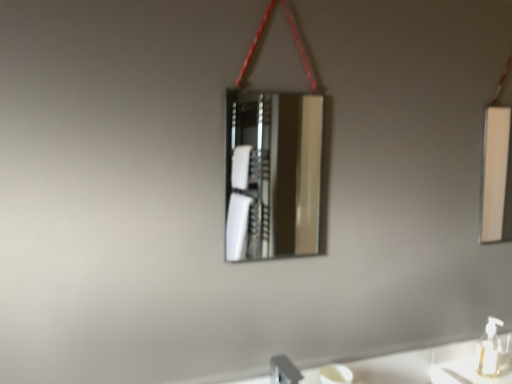
Question: In which direction should I rotate to look at polished silver mirror at center, placed as the first mirror when sorted from left to right?

Choices:
 (A) left
 (B) right

Answer: (B)

Question: Is white glossy mirror at right, arranged as the 2th mirror when viewed from the left, with polished silver mirror at center, which ranks as the first mirror in front-to-back order?

Choices:
 (A) yes
 (B) no

Answer: (B)

Question: Considering the relative sizes of white glossy mirror at right, placed as the 2th mirror when sorted from front to back, and polished silver mirror at center, placed as the first mirror when sorted from left to right, in the image provided, is white glossy mirror at right, placed as the 2th mirror when sorted from front to back, wider than polished silver mirror at center, placed as the first mirror when sorted from left to right,?

Choices:
 (A) yes
 (B) no

Answer: (B)

Question: Is white glossy mirror at right, placed as the 2th mirror when sorted from front to back, at the left side of polished silver mirror at center, placed as the second mirror when sorted from back to front?

Choices:
 (A) no
 (B) yes

Answer: (A)

Question: From the image's perspective, is white glossy mirror at right, arranged as the 2th mirror when viewed from the left, above polished silver mirror at center, placed as the second mirror when sorted from back to front?

Choices:
 (A) no
 (B) yes

Answer: (B)

Question: Is white glossy mirror at right, placed as the first mirror when sorted from right to left, taller than polished silver mirror at center, placed as the second mirror when sorted from back to front?

Choices:
 (A) yes
 (B) no

Answer: (B)

Question: Does white glossy mirror at right, the 1th mirror when ordered from back to front, contain polished silver mirror at center, placed as the second mirror when sorted from back to front?

Choices:
 (A) yes
 (B) no

Answer: (B)

Question: From the image's perspective, is white plastic soap dispenser at lower right below silver metallic faucet at lower center?

Choices:
 (A) no
 (B) yes

Answer: (A)

Question: Is white plastic soap dispenser at lower right thinner than silver metallic faucet at lower center?

Choices:
 (A) no
 (B) yes

Answer: (B)

Question: Can you confirm if white plastic soap dispenser at lower right is taller than silver metallic faucet at lower center?

Choices:
 (A) yes
 (B) no

Answer: (A)

Question: Would you say white plastic soap dispenser at lower right is a long distance from silver metallic faucet at lower center?

Choices:
 (A) no
 (B) yes

Answer: (A)

Question: From a real-world perspective, is white plastic soap dispenser at lower right positioned under silver metallic faucet at lower center based on gravity?

Choices:
 (A) no
 (B) yes

Answer: (A)

Question: Is white plastic soap dispenser at lower right shorter than silver metallic faucet at lower center?

Choices:
 (A) no
 (B) yes

Answer: (A)

Question: From a real-world perspective, is silver metallic faucet at lower center under white glossy mirror at right, placed as the 2th mirror when sorted from front to back?

Choices:
 (A) no
 (B) yes

Answer: (B)